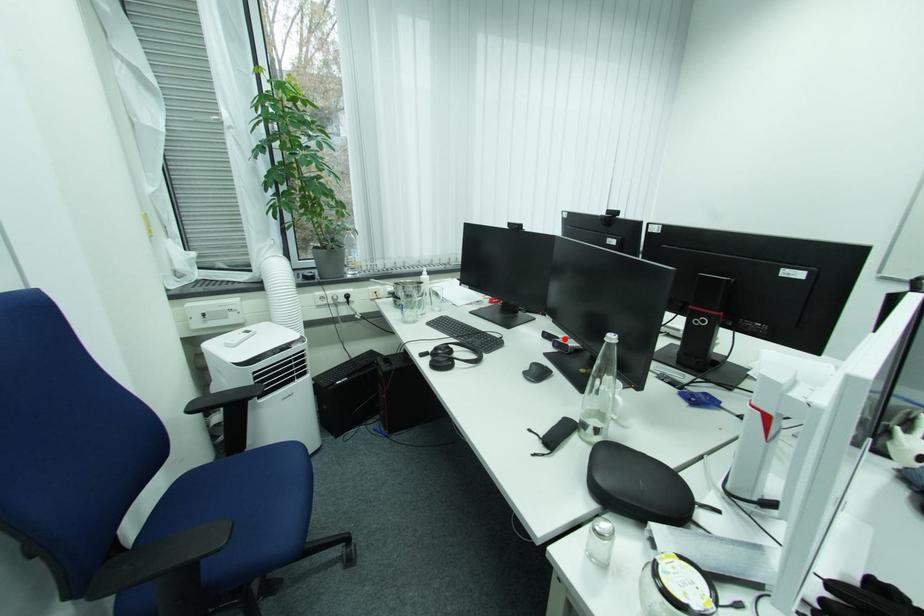
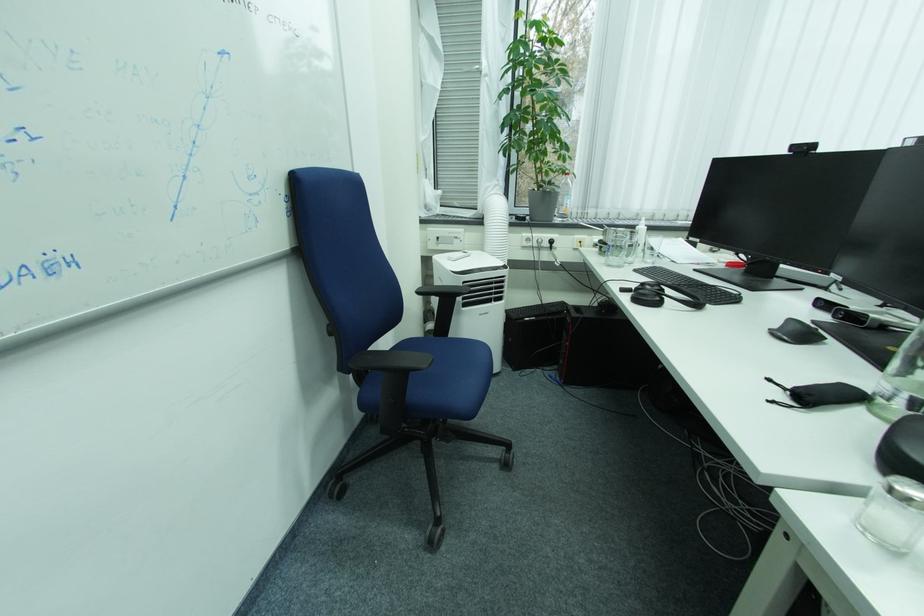
Where in the second image is the point corresponding to the highlighted location from the first image?

(854, 309)